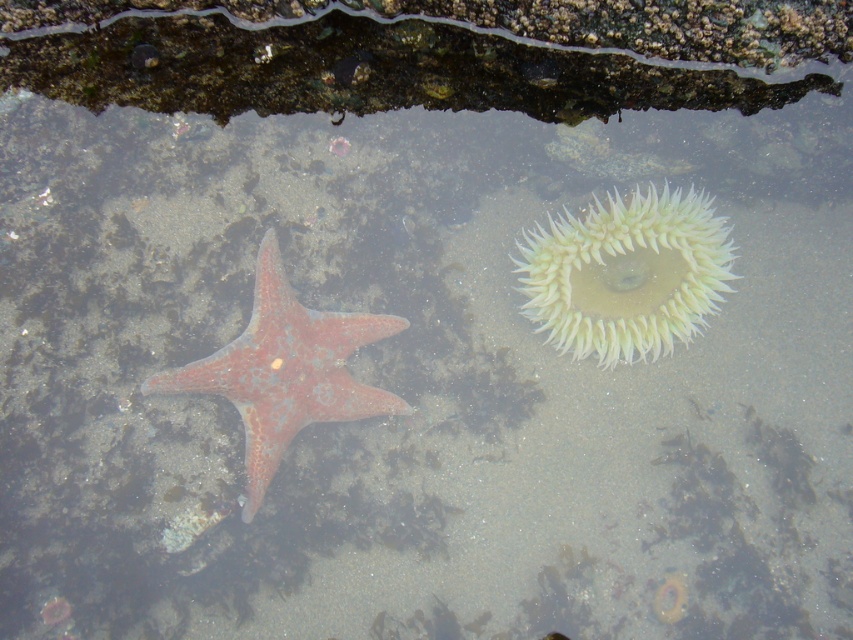
Question: Does white spiky anemone at upper right appear over rusty matte starfish at center?

Choices:
 (A) no
 (B) yes

Answer: (B)

Question: Which object appears closest to the camera in this image?

Choices:
 (A) white spiky anemone at upper right
 (B) rusty matte starfish at center

Answer: (B)

Question: Which of the following is the farthest from the observer?

Choices:
 (A) white spiky anemone at upper right
 (B) rusty matte starfish at center

Answer: (A)

Question: Is white spiky anemone at upper right to the right of rusty matte starfish at center from the viewer's perspective?

Choices:
 (A) no
 (B) yes

Answer: (B)

Question: Does white spiky anemone at upper right appear under rusty matte starfish at center?

Choices:
 (A) yes
 (B) no

Answer: (B)